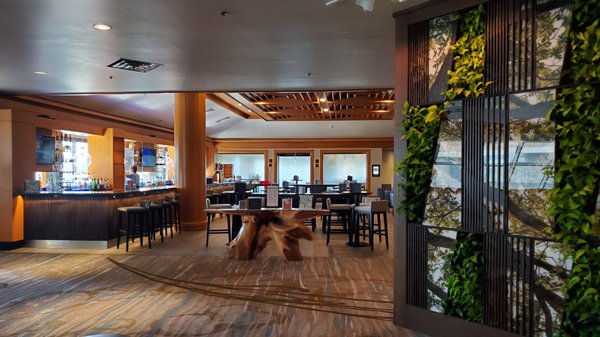
Locate an element on the screen. Image resolution: width=600 pixels, height=337 pixels. baseboard is located at coordinates [x=95, y=245].